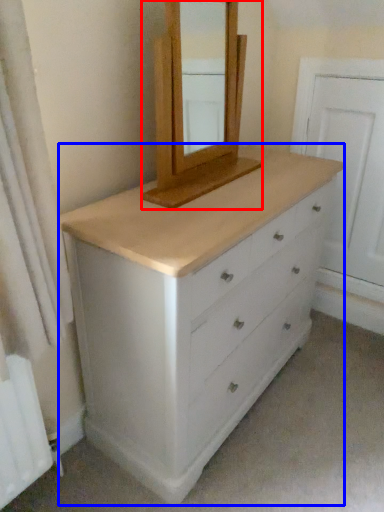
Question: Which point is further to the camera, medicine cabinet (highlighted by a red box) or chest of drawers (highlighted by a blue box)?

Choices:
 (A) medicine cabinet
 (B) chest of drawers

Answer: (A)